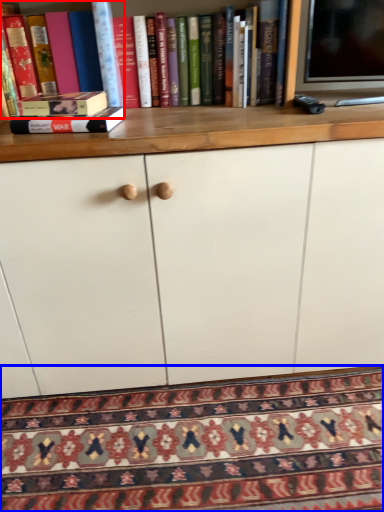
Question: Which object appears closest to the camera in this image, book (highlighted by a red box) or mat (highlighted by a blue box)?

Choices:
 (A) book
 (B) mat

Answer: (B)